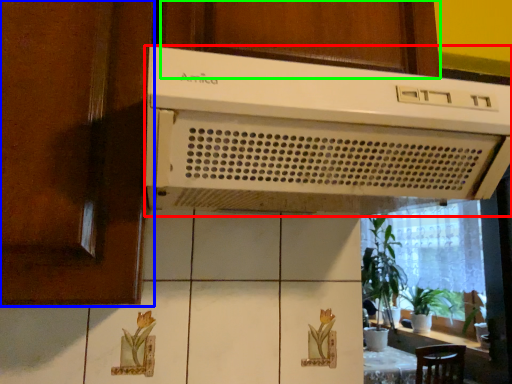
Question: Considering the real-world distances, which object is farthest from home appliance (highlighted by a red box)? screen door (highlighted by a blue box) or cabinetry (highlighted by a green box)?

Choices:
 (A) screen door
 (B) cabinetry

Answer: (A)